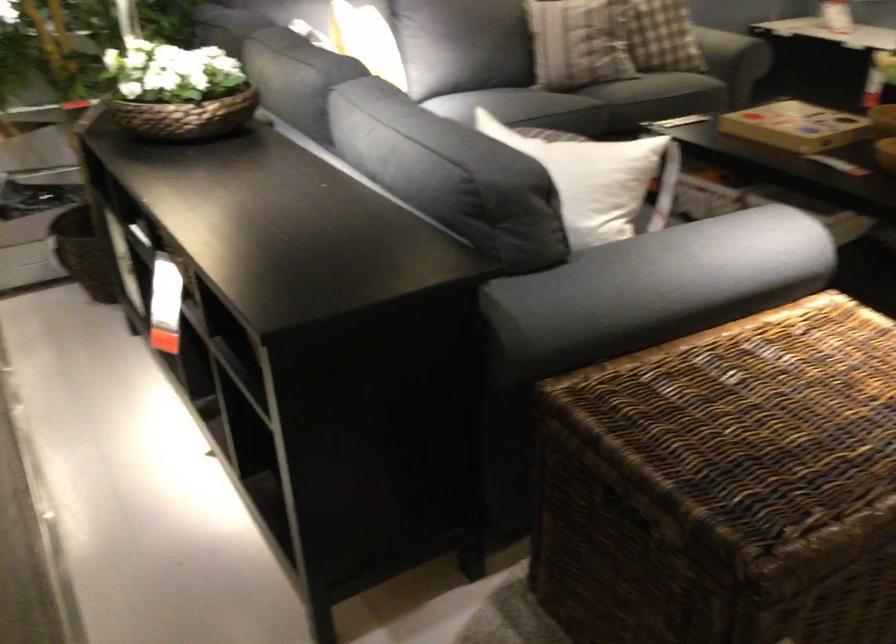
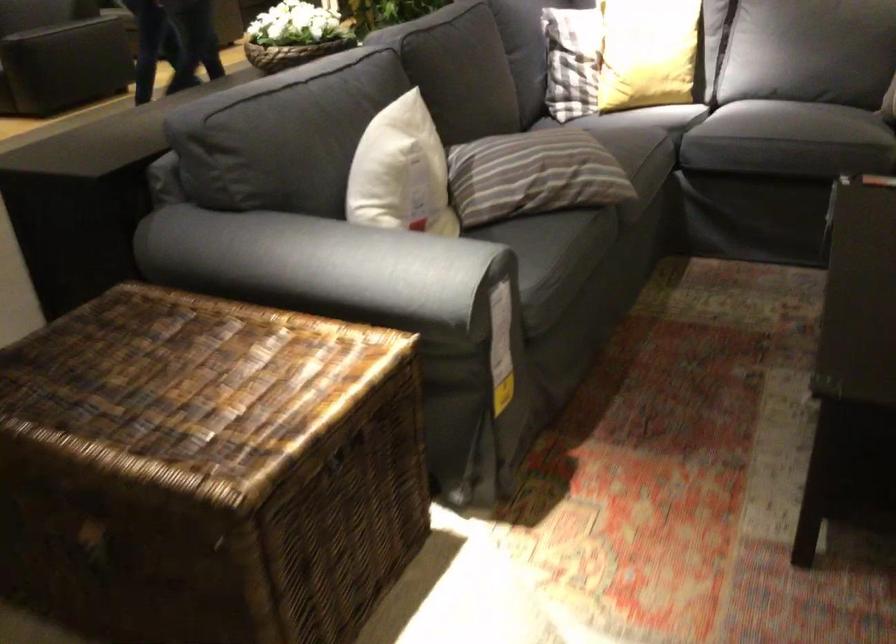
Where in the second image is the point corresponding to pixel 238 100 from the first image?

(291, 53)